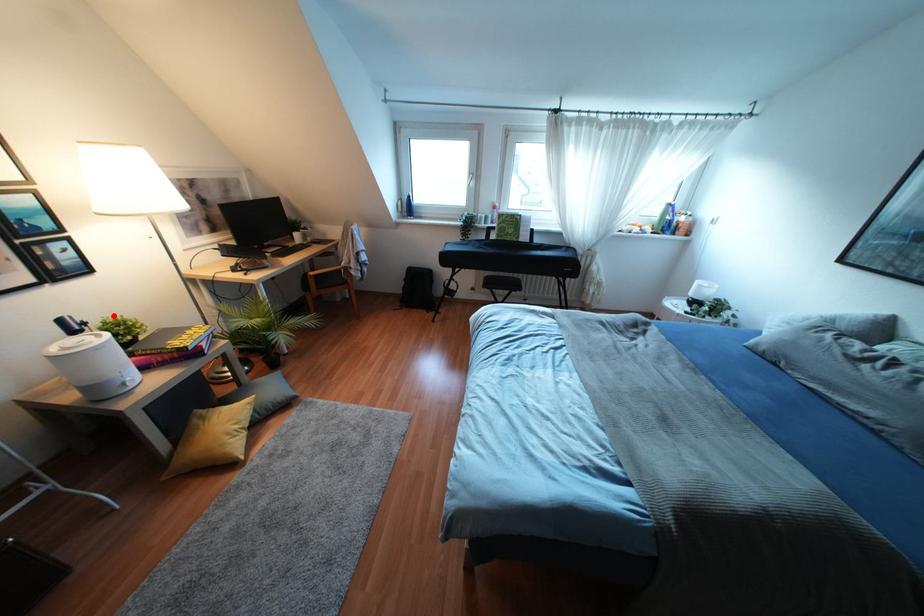
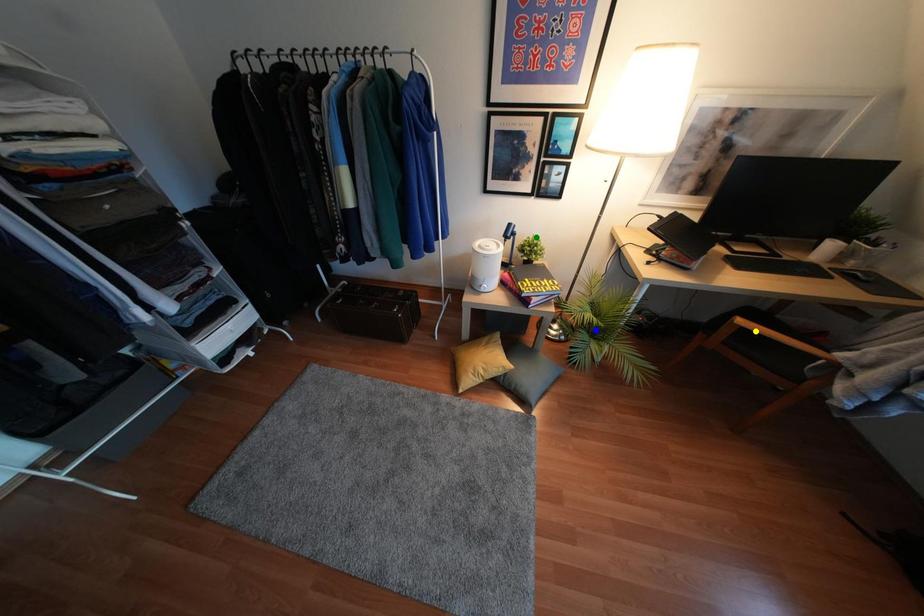
Question: I am providing you with two images of the same scene from different viewpoints. A red point is marked on the first image. You are given multiple points on the second image. Which point in image 2 represents the same 3d spot as the red point in image 1?

Choices:
 (A) yellow point
 (B) blue point
 (C) green point

Answer: (C)